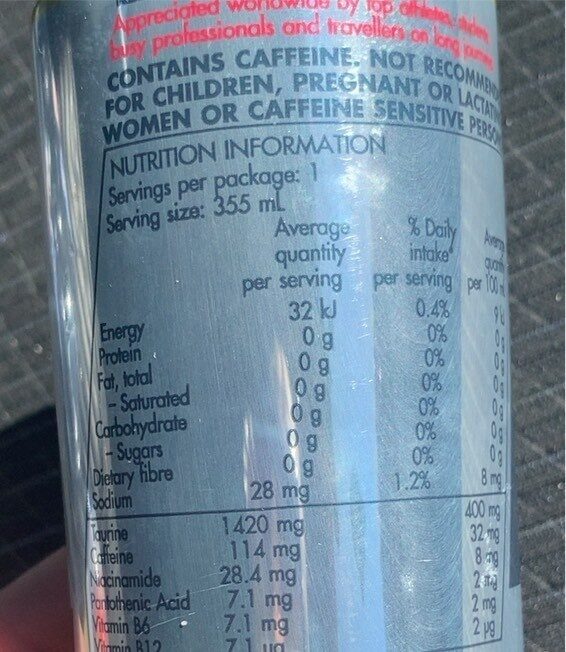
Find the location of a particular element. This screenshot has width=566, height=652. floor is located at coordinates (541, 168).